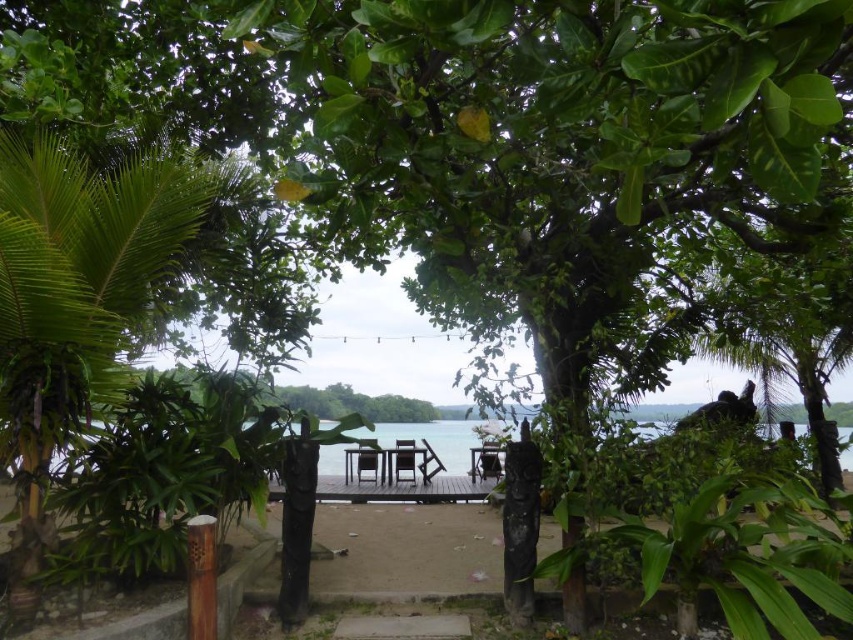
Question: Is dark brown wooden picnic table at center above wooden picnic table at center?

Choices:
 (A) yes
 (B) no

Answer: (A)

Question: Which point is farther from the camera taking this photo?

Choices:
 (A) (496, 472)
 (B) (393, 467)

Answer: (B)

Question: Does dark brown wooden picnic table at center appear under wooden picnic table at center?

Choices:
 (A) yes
 (B) no

Answer: (B)

Question: Does dark brown wooden picnic table at center have a greater width compared to wooden picnic table at center?

Choices:
 (A) yes
 (B) no

Answer: (A)